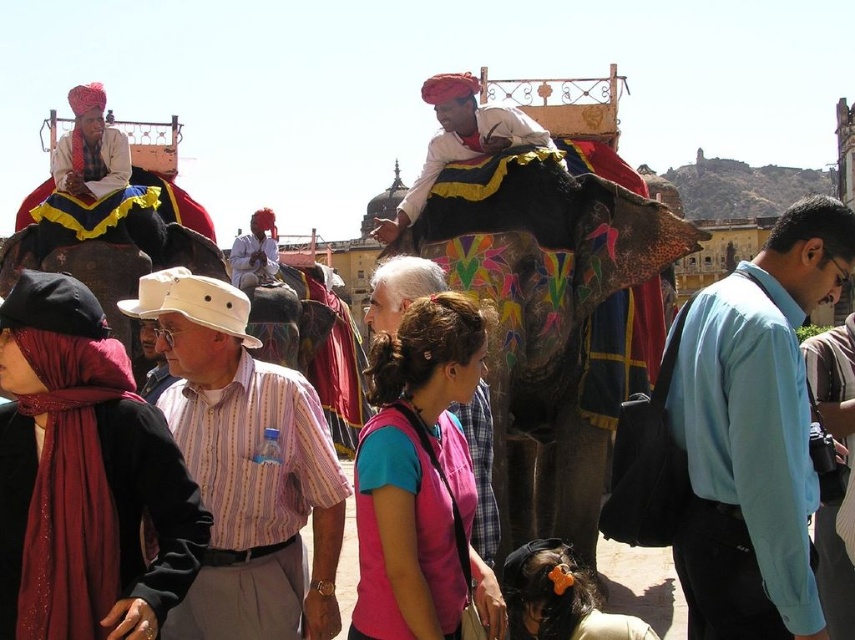
Question: Does painted fabric-covered elephant at center have a greater width compared to matte white shirt at center?

Choices:
 (A) no
 (B) yes

Answer: (B)

Question: Is matte white shirt at center below white matte cowboy hat at center?

Choices:
 (A) no
 (B) yes

Answer: (A)

Question: Which object is farther from the camera taking this photo?

Choices:
 (A) matte white shirt at center
 (B) striped cotton shirt at center

Answer: (A)

Question: Which point is closer to the camera taking this photo?

Choices:
 (A) (806, 432)
 (B) (472, 189)
 (C) (467, 93)
 (D) (1, 529)

Answer: (D)

Question: Which point is farther from the camera taking this photo?

Choices:
 (A) (834, 221)
 (B) (98, 460)
 (C) (503, 131)
 (D) (81, 170)

Answer: (D)

Question: Is black fabric scarf at left positioned in front of white matte cowboy hat at center?

Choices:
 (A) yes
 (B) no

Answer: (A)